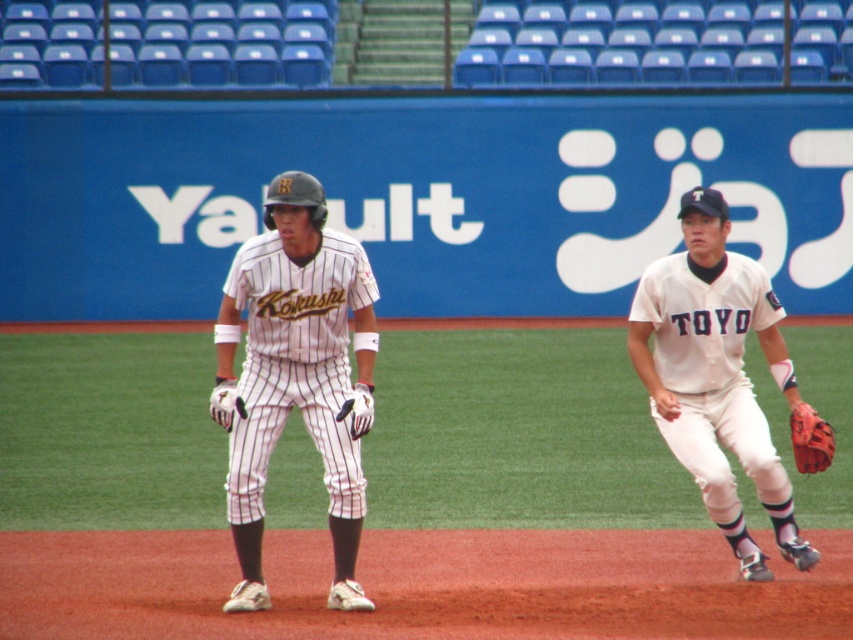
Is white synthetic glove at center shorter than white leather glove at center?

No, white synthetic glove at center is not shorter than white leather glove at center.

Between white synthetic glove at center and white leather glove at center, which one has less height?

white leather glove at center is shorter.

Between point (364, 397) and point (222, 413), which one is positioned behind?

The point (364, 397) is more distant.

Locate an element on the screen. Image resolution: width=853 pixels, height=640 pixels. white synthetic glove at center is located at coordinates (358, 410).

Does white pinstriped uniform at center appear under white synthetic glove at center?

Incorrect, white pinstriped uniform at center is not positioned below white synthetic glove at center.

Can you confirm if white pinstriped uniform at center is positioned above white synthetic glove at center?

Correct, white pinstriped uniform at center is located above white synthetic glove at center.

Is point (354, 582) positioned after point (344, 413)?

Yes.

Where is `white pinstriped uniform at center`? The height and width of the screenshot is (640, 853). white pinstriped uniform at center is located at coordinates (296, 372).

Between white matte baseball uniform at right and white leather glove at center, which one appears on the left side from the viewer's perspective?

From the viewer's perspective, white leather glove at center appears more on the left side.

What do you see at coordinates (717, 376) in the screenshot? I see `white matte baseball uniform at right` at bounding box center [717, 376].

Is point (703, 460) farther from viewer compared to point (229, 429)?

Yes, point (703, 460) is behind point (229, 429).

You are a GUI agent. You are given a task and a screenshot of the screen. Output one action in this format:
    pyautogui.click(x=<x>, y=<y>)
    Task: Click on the white matte baseball uniform at right
    The height and width of the screenshot is (640, 853).
    Given the screenshot: What is the action you would take?
    pyautogui.click(x=717, y=376)